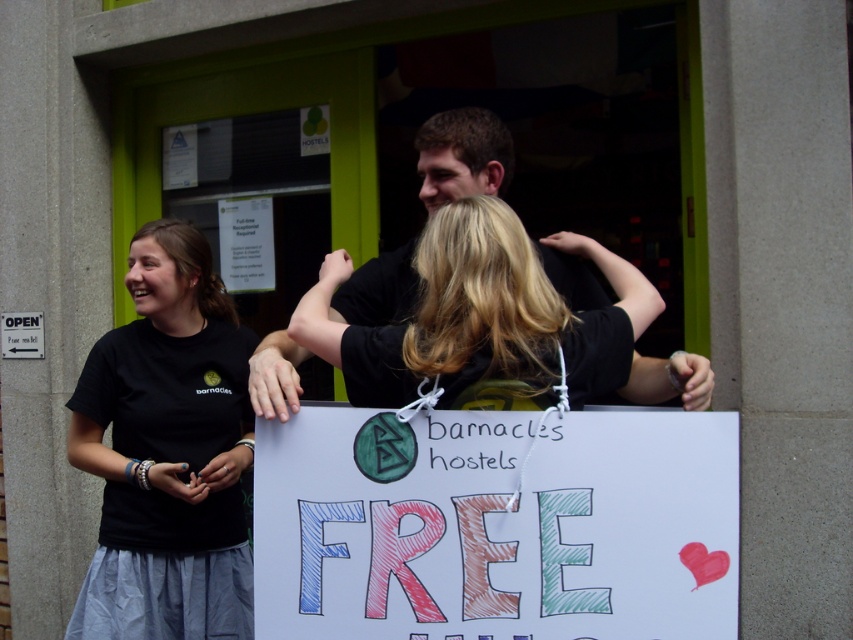
Looking at this image, between black cotton t-shirt at left and black matte shirt at center, which one appears on the left side from the viewer's perspective?

From the viewer's perspective, black cotton t-shirt at left appears more on the left side.

Does black cotton t-shirt at left appear over black matte shirt at center?

No.

What do you see at coordinates (167, 451) in the screenshot?
I see `black cotton t-shirt at left` at bounding box center [167, 451].

You are a GUI agent. You are given a task and a screenshot of the screen. Output one action in this format:
    pyautogui.click(x=<x>, y=<y>)
    Task: Click on the black cotton t-shirt at left
    
    Given the screenshot: What is the action you would take?
    pyautogui.click(x=167, y=451)

Can you confirm if hand-drawn paper sign at center is positioned to the left of black cotton t-shirt at left?

Incorrect, hand-drawn paper sign at center is not on the left side of black cotton t-shirt at left.

Between hand-drawn paper sign at center and black cotton t-shirt at left, which one has more height?

Standing taller between the two is black cotton t-shirt at left.

What are the coordinates of `hand-drawn paper sign at center` in the screenshot? It's located at (496, 524).

Is hand-drawn paper sign at center bigger than black matte shirt at center?

No, hand-drawn paper sign at center is not bigger than black matte shirt at center.

Who is more forward, (637, 422) or (537, 324)?

Point (637, 422)

Who is more distant from viewer, [358,595] or [314,337]?

The point [314,337] is behind.

This screenshot has width=853, height=640. Find the location of `hand-drawn paper sign at center`. hand-drawn paper sign at center is located at coordinates (496, 524).